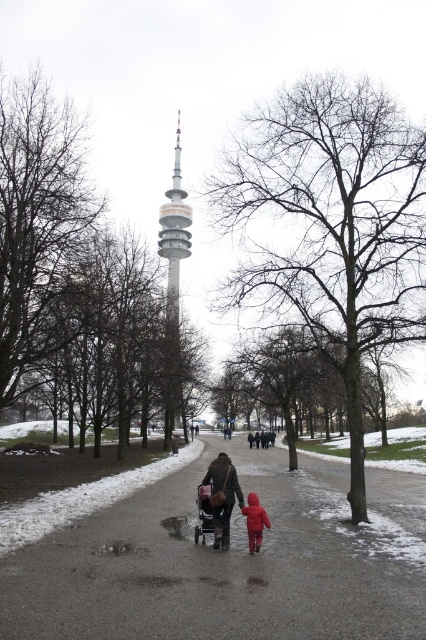
Question: Is brown leather jacket at center to the right of dark brown leather jacket at center from the viewer's perspective?

Choices:
 (A) yes
 (B) no

Answer: (B)

Question: Does brown leather jacket at center come behind red matte jacket at center?

Choices:
 (A) no
 (B) yes

Answer: (B)

Question: Which object is the farthest from the smooth asphalt path at center?

Choices:
 (A) brown leather jacket at center
 (B) black plastic baby carriage at center
 (C) silver metallic tower at center

Answer: (C)

Question: Which object appears closest to the camera in this image?

Choices:
 (A) dark brown leather jacket at center
 (B) red matte jacket at center
 (C) black plastic baby carriage at center
 (D) silver metallic tower at center

Answer: (B)

Question: Estimate the real-world distances between objects in this image. Which object is farther from the smooth asphalt path at center?

Choices:
 (A) red matte jacket at center
 (B) silver metallic tower at center
 (C) dark brown leather jacket at center
 (D) brown leather jacket at center

Answer: (C)

Question: Does black plastic baby carriage at center appear over red matte jacket at center?

Choices:
 (A) yes
 (B) no

Answer: (A)